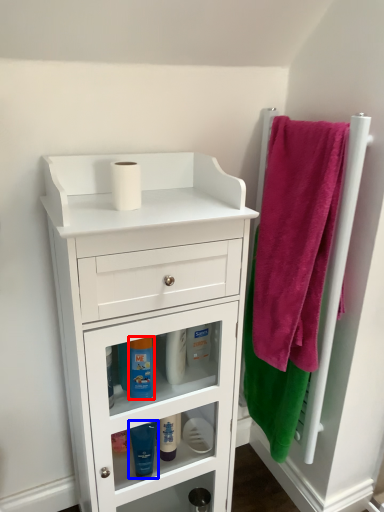
Question: Which of the following is the farthest to the observer, mouthwash (highlighted by a red box) or mouthwash (highlighted by a blue box)?

Choices:
 (A) mouthwash
 (B) mouthwash

Answer: (B)